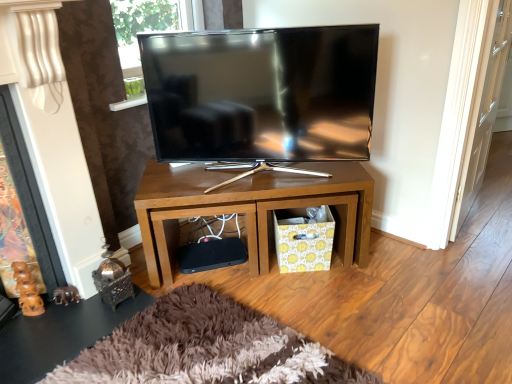
Where is `free space in front of polished metal lantern at lower left`? This screenshot has height=384, width=512. free space in front of polished metal lantern at lower left is located at coordinates (94, 324).